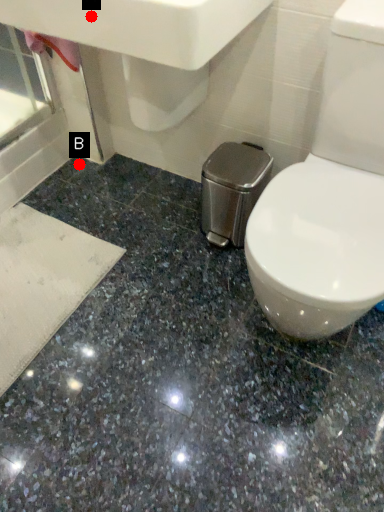
Question: Two points are circled on the image, labeled by A and B beside each circle. Which point appears closest to the camera in this image?

Choices:
 (A) A is closer
 (B) B is closer

Answer: (A)